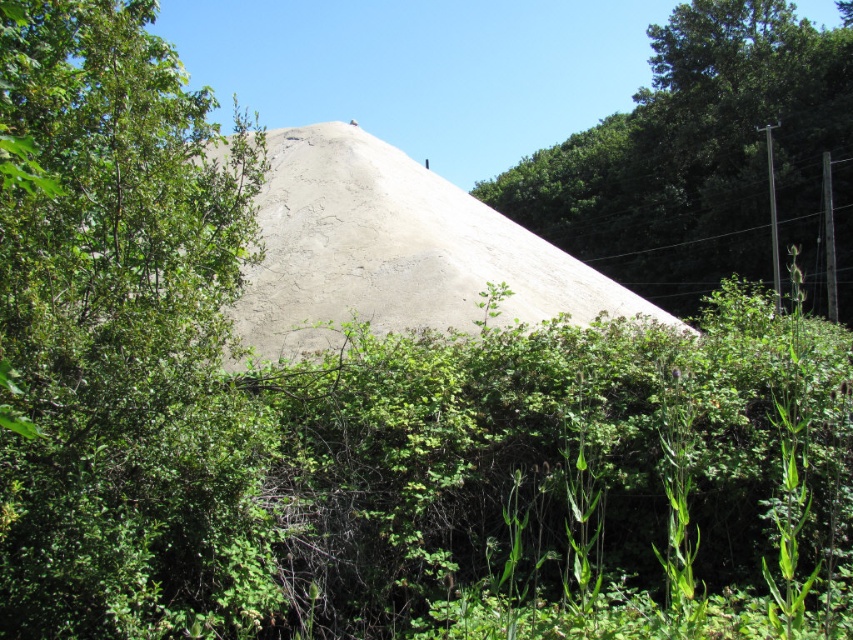
Based on the scene described, which object has a smaller width between the green leafy tree at upper left and the smooth concrete hillside at center?

The green leafy tree at upper left has a smaller width compared to the smooth concrete hillside at center.

You are a hiker who wants to take a shortcut from the green leafy tree at upper left to the smooth concrete hillside at center. Is the path directly between them blocked by any objects?

The green leafy tree at upper left is positioned under the smooth concrete hillside at center, so the path between them is blocked by the hillside itself.

You are standing at the base of the conical mound of sand or gravel in the image. Looking towards the upper right corner, can you see the green leafy tree at upper right? Please describe its position relative to the mound.

Yes, the green leafy tree at upper right is located at the upper right corner of the image, positioned above and to the right of the conical mound of sand or gravel.